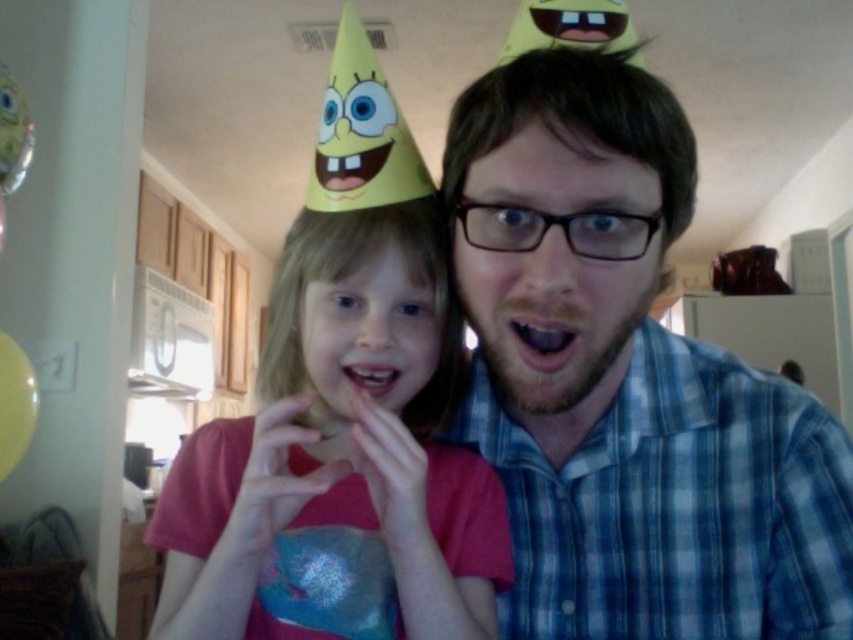
Question: Observing the image, what is the correct spatial positioning of blue plaid shirt at center in reference to pink fabric dress at center?

Choices:
 (A) above
 (B) below

Answer: (A)

Question: Is blue plaid shirt at center thinner than pink fabric dress at center?

Choices:
 (A) yes
 (B) no

Answer: (B)

Question: Which point is farther to the camera?

Choices:
 (A) pink fabric dress at center
 (B) blue plaid shirt at center

Answer: (A)

Question: Which point is closer to the camera?

Choices:
 (A) (799, 465)
 (B) (392, 600)

Answer: (B)

Question: Is the position of blue plaid shirt at center more distant than that of pink fabric dress at center?

Choices:
 (A) no
 (B) yes

Answer: (A)

Question: Which object appears farthest from the camera in this image?

Choices:
 (A) pink fabric dress at center
 (B) blue plaid shirt at center

Answer: (A)